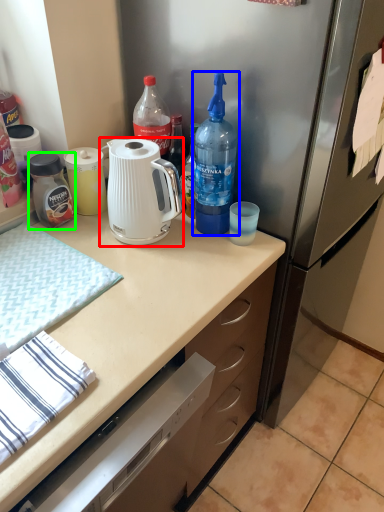
Question: Based on their relative distances, which object is nearer to kettle (highlighted by a red box)? Choose from bottle (highlighted by a blue box) and bottle (highlighted by a green box).

Choices:
 (A) bottle
 (B) bottle

Answer: (A)